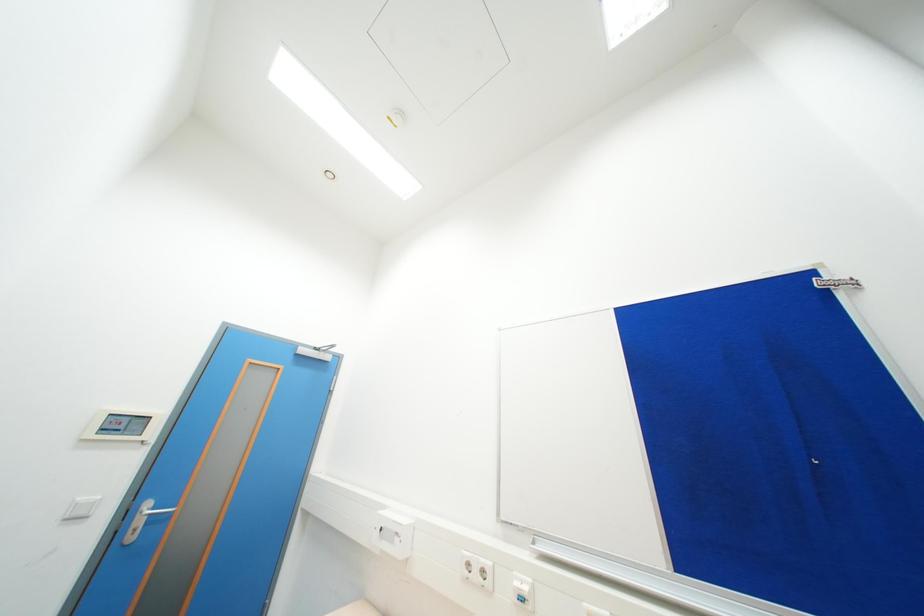
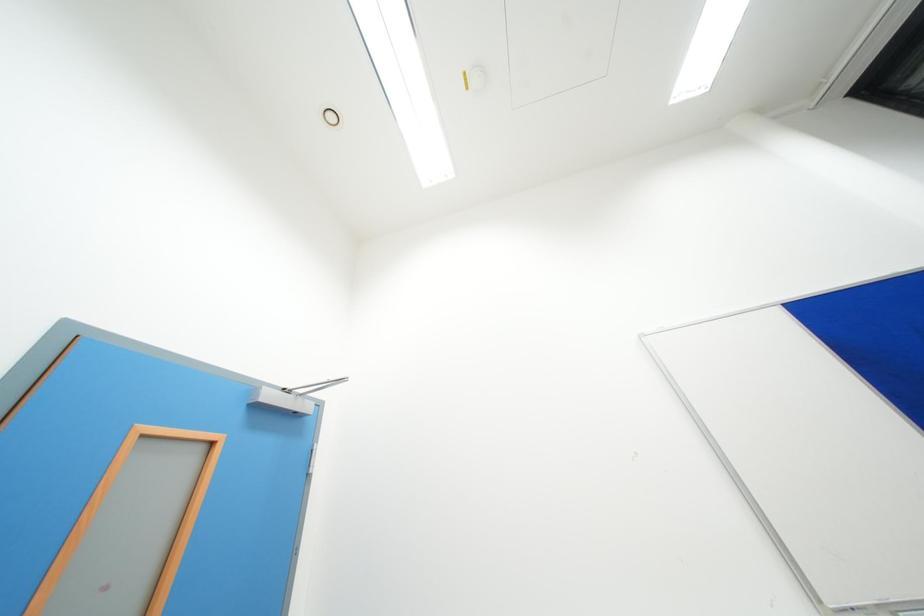
Consider the image. What movement of the cameraman would produce the second image?

The movement direction of the cameraman is left, forward.